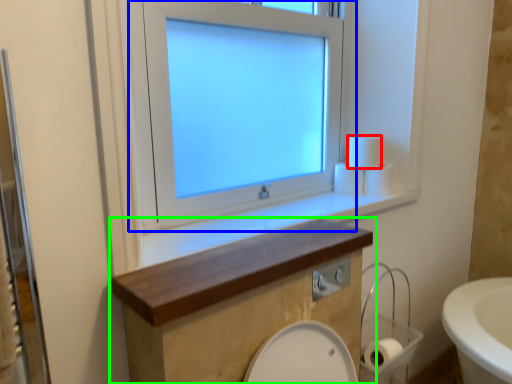
Question: Which object is positioned farthest from toilet paper (highlighted by a red box)? Select from window (highlighted by a blue box) and bathroom cabinet (highlighted by a green box).

Choices:
 (A) window
 (B) bathroom cabinet

Answer: (B)